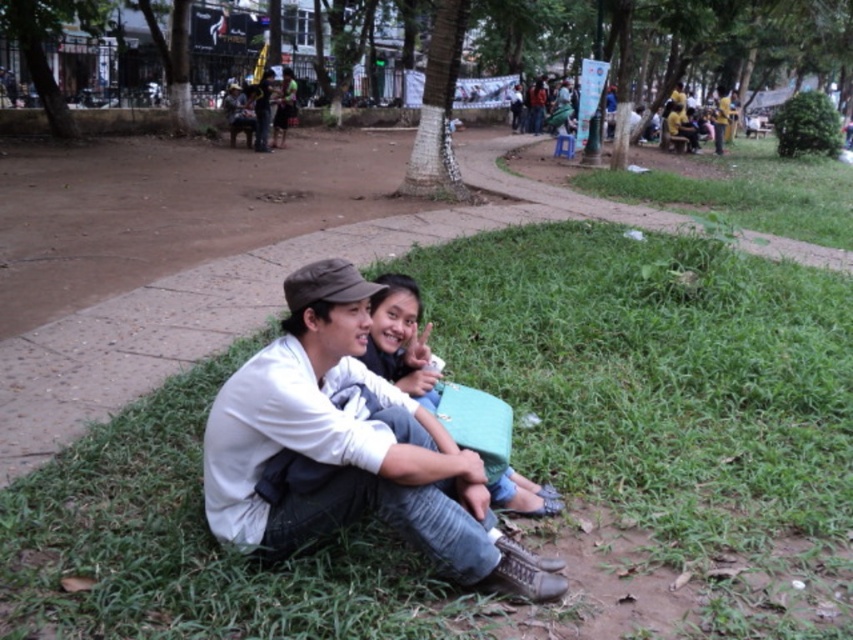
You are a photographer standing in the park and want to capture a photo that includes both the green grass at lower center and the white matte shirt at center. Based on their positions, which object should you focus on first to ensure both are in sharp focus?

The green grass at lower center is further to the viewer than the white matte shirt at center, so you should focus on the white matte shirt at center first to ensure both are in sharp focus.

You are planning to lay down a picnic blanket in this park scene. The blanket you have is 1.5 meters wide. Based on the image, will the green grass at lower center be wide enough to accommodate your blanket without overlapping the white matte shirt at center?

The green grass at lower center is wider than the white matte shirt at center. Since the blanket is 1.5 meters wide, and the grass area is wider, it should be possible to place the blanket on the green grass at lower center without overlapping the shirt.